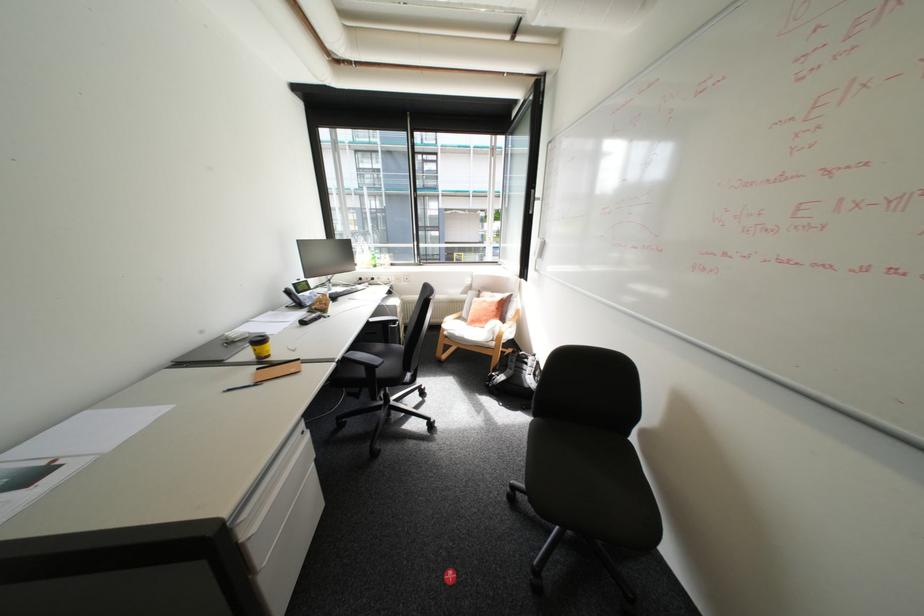
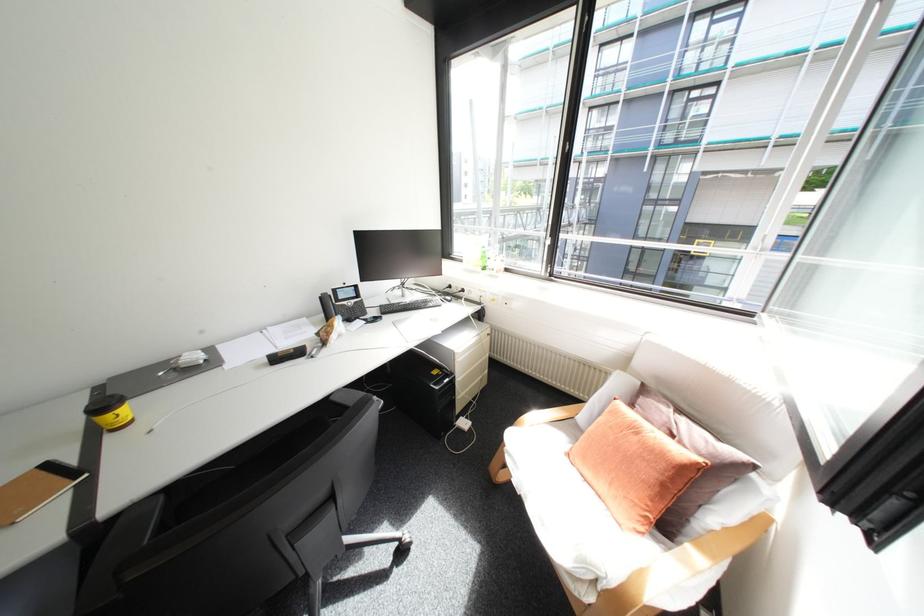
Where in the second image is the point corresponding to the point at 499,294 from the first image?

(677, 410)